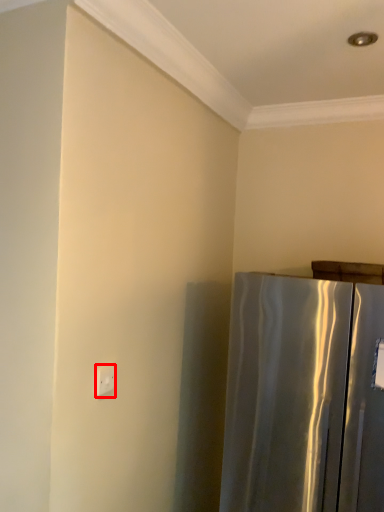
Question: From the image's perspective, what is the correct spatial relationship of electric outlet (annotated by the red box) in relation to refrigerator?

Choices:
 (A) above
 (B) below

Answer: (A)